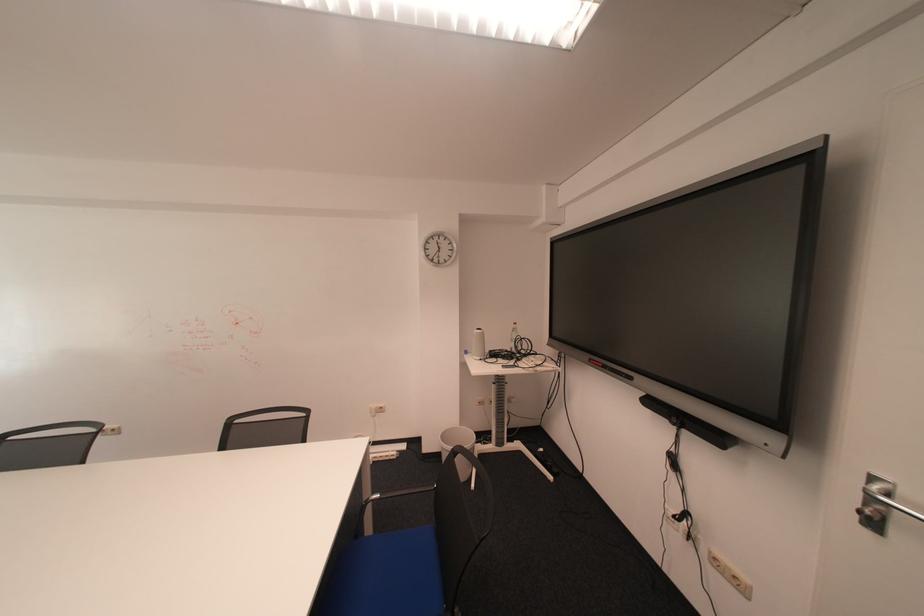
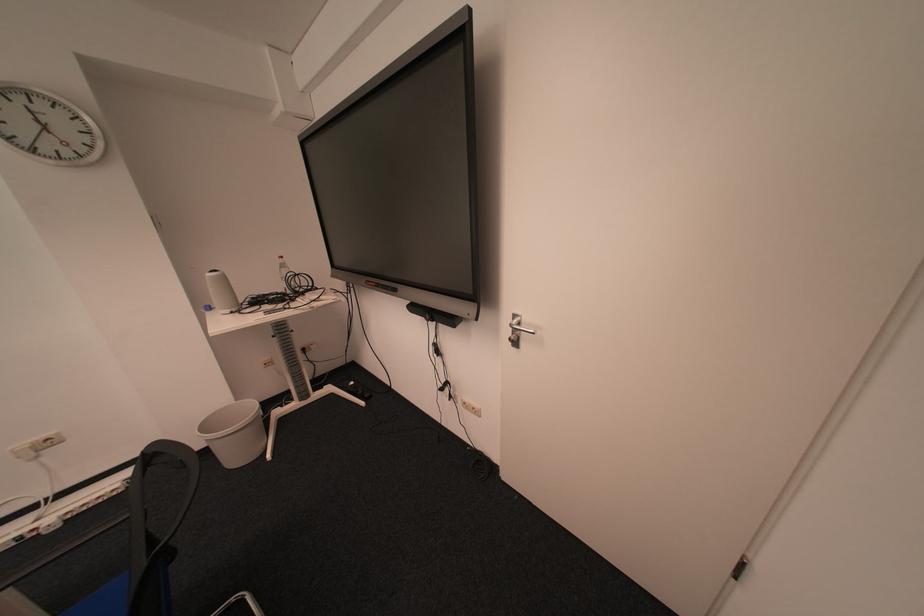
Find the pixel in the second image that matches (456,437) in the first image.

(216, 426)